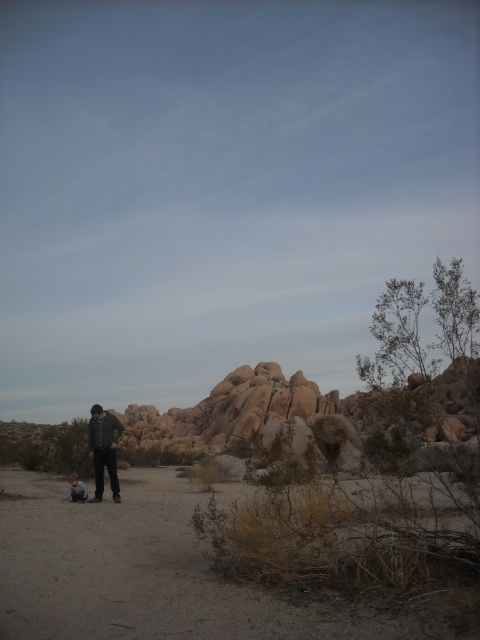
Question: Which of the following is the farthest from the observer?

Choices:
 (A) dark gray jacket at center
 (B) light brown skin at lower center

Answer: (A)

Question: Among these objects, which one is farthest from the camera?

Choices:
 (A) dark gray jacket at center
 (B) light brown skin at lower center

Answer: (A)

Question: Is dark gray jacket at center smaller than light brown skin at lower center?

Choices:
 (A) yes
 (B) no

Answer: (A)

Question: Considering the relative positions of dark gray jacket at center and light brown skin at lower center in the image provided, where is dark gray jacket at center located with respect to light brown skin at lower center?

Choices:
 (A) left
 (B) right

Answer: (B)

Question: Which of the following is the farthest from the observer?

Choices:
 (A) light brown skin at lower center
 (B) dark gray jacket at center

Answer: (B)

Question: Observing the image, what is the correct spatial positioning of dark gray jacket at center in reference to light brown skin at lower center?

Choices:
 (A) above
 (B) below

Answer: (A)